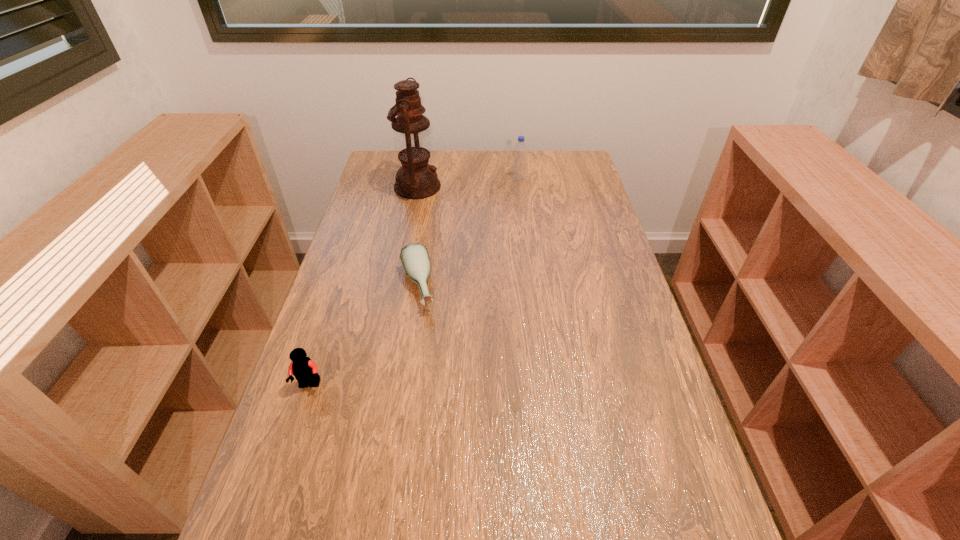
Find the location of a particular element. This screenshot has height=540, width=960. free area in between the nearest object and the left bottle is located at coordinates (364, 336).

At what (x,y) coordinates should I click in order to perform the action: click on empty location between the second shortest object and the third farthest object. Please return your answer as a coordinate pair (x, y). Looking at the image, I should click on (364, 336).

Where is `free spot between the right bottle and the left bottle`? This screenshot has height=540, width=960. free spot between the right bottle and the left bottle is located at coordinates (468, 233).

Identify the location of vacant area that lies between the oil lamp and the nearest object. The height and width of the screenshot is (540, 960). (364, 286).

Locate an element on the screen. This screenshot has width=960, height=540. vacant point located between the second tallest object and the shorter bottle is located at coordinates (468, 233).

You are a GUI agent. You are given a task and a screenshot of the screen. Output one action in this format:
    pyautogui.click(x=<x>, y=<y>)
    Task: Click on the free space between the rightmost object and the third farthest object
    Image resolution: width=960 pixels, height=540 pixels.
    Given the screenshot: What is the action you would take?
    pyautogui.click(x=468, y=233)

Image resolution: width=960 pixels, height=540 pixels. Find the location of `vacant region between the right bottle and the oil lamp`. vacant region between the right bottle and the oil lamp is located at coordinates (468, 183).

Find the location of a particular element. object that is the closest to the left bottle is located at coordinates (305, 371).

At what (x,y) coordinates should I click in order to perform the action: click on object that is the closest one to the rightmost object. Please return your answer as a coordinate pair (x, y). Image resolution: width=960 pixels, height=540 pixels. Looking at the image, I should click on point(416,179).

Find the location of a particular element. This screenshot has height=540, width=960. vacant space that satisfies the following two spatial constraints: 1. on the back side of the third farthest object; 2. on the right side of the right bottle is located at coordinates (433, 179).